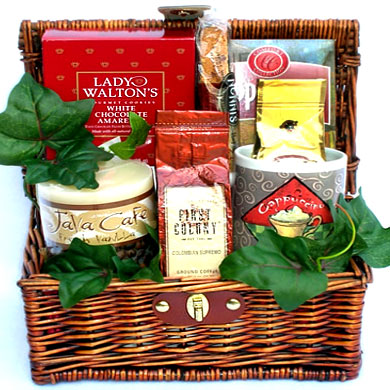
Where is `containers`? containers is located at coordinates (117, 206), (295, 182).